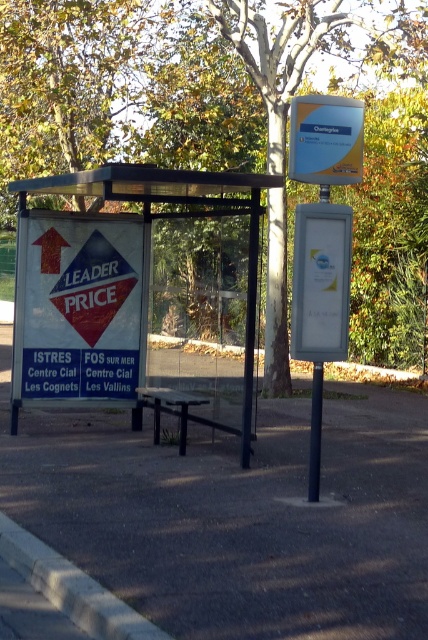
Which of these two, white plastic sign at center or black plastic pole at center, stands shorter?

black plastic pole at center is shorter.

The image size is (428, 640). Describe the element at coordinates (321, 241) in the screenshot. I see `white plastic sign at center` at that location.

Where is `white plastic sign at center`? white plastic sign at center is located at coordinates (321, 241).

Who is lower down, white plastic bus stop at center or white paper sign at left?

Positioned lower is white paper sign at left.

Based on the photo, does white plastic bus stop at center have a lesser height compared to white paper sign at left?

In fact, white plastic bus stop at center may be taller than white paper sign at left.

Does point (149, 392) come farther from viewer compared to point (26, 285)?

No.

Locate an element on the screen. This screenshot has height=640, width=428. white plastic bus stop at center is located at coordinates (140, 296).

In the scene shown: Does gray concrete curb at lower left have a greater width compared to black plastic pole at center?

Yes, gray concrete curb at lower left is wider than black plastic pole at center.

Which of these two, gray concrete curb at lower left or black plastic pole at center, stands shorter?

gray concrete curb at lower left

Is point (62, 609) positioned after point (314, 445)?

No, (62, 609) is in front of (314, 445).

You are a GUI agent. You are given a task and a screenshot of the screen. Output one action in this format:
    pyautogui.click(x=<x>, y=<y>)
    Task: Click on the gray concrete curb at lower left
    The width and height of the screenshot is (428, 640).
    Given the screenshot: What is the action you would take?
    pyautogui.click(x=71, y=588)